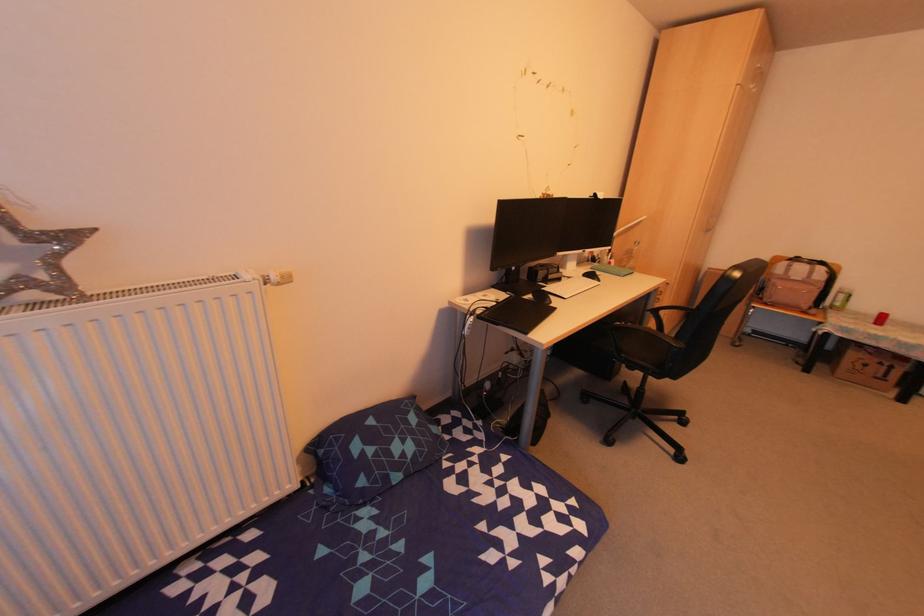
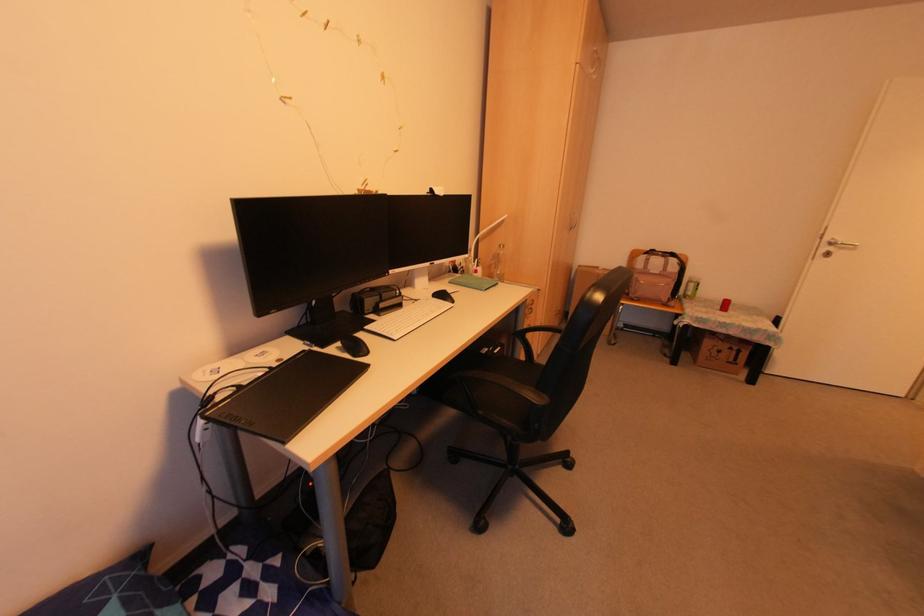
Locate, in the second image, the point that corresponds to pixel 797 280 in the first image.

(655, 273)